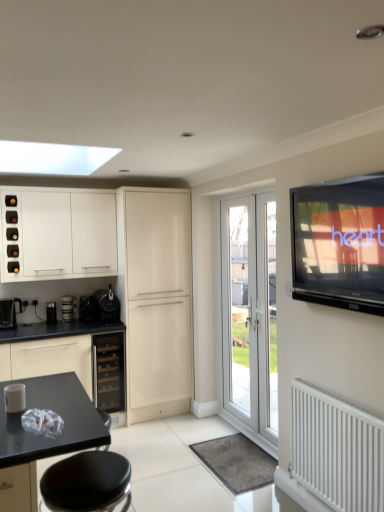
The width and height of the screenshot is (384, 512). What are the coordinates of `free spot above flat-screen tv at upper right (from a real-world perspective)` in the screenshot? It's located at (343, 176).